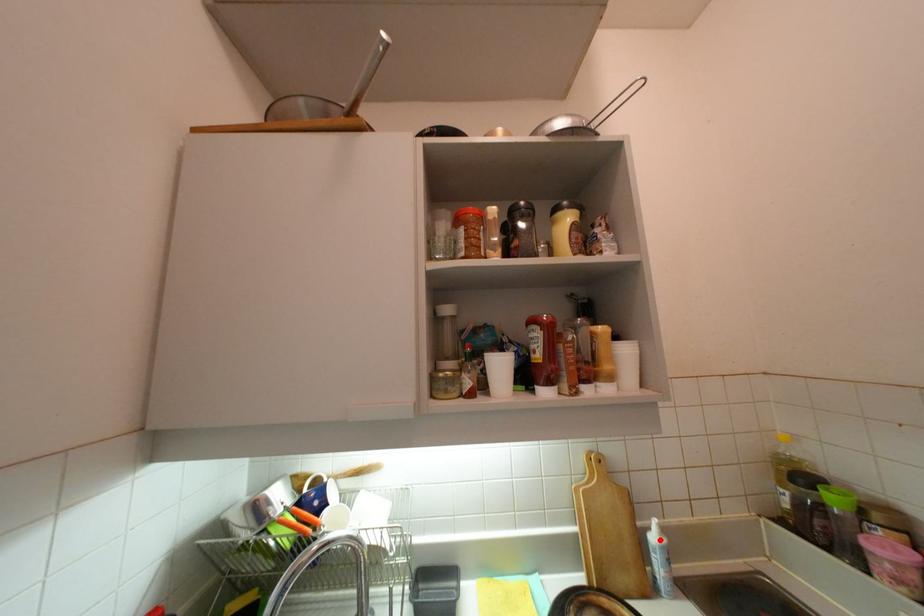
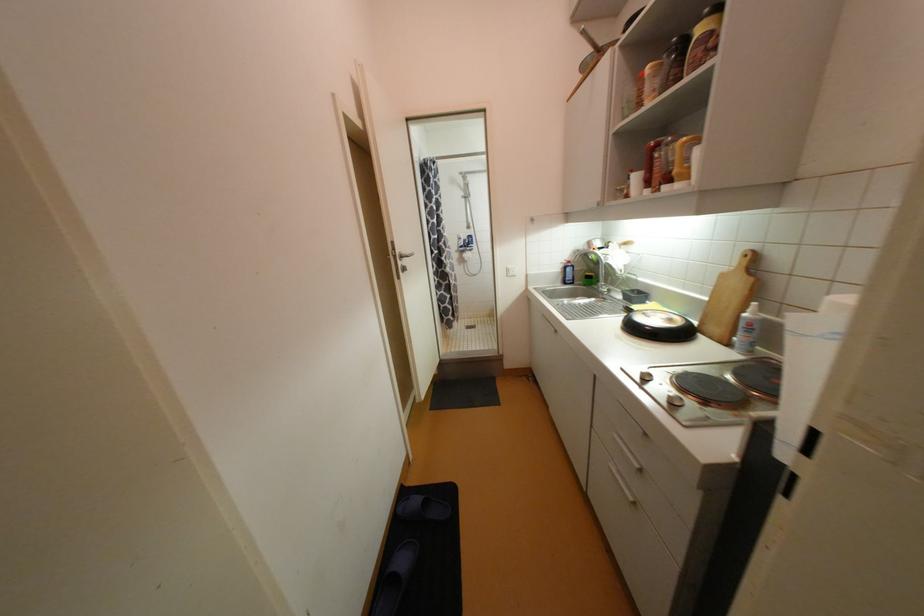
The point at the highlighted location is marked in the first image. Where is the corresponding point in the second image?

(750, 315)